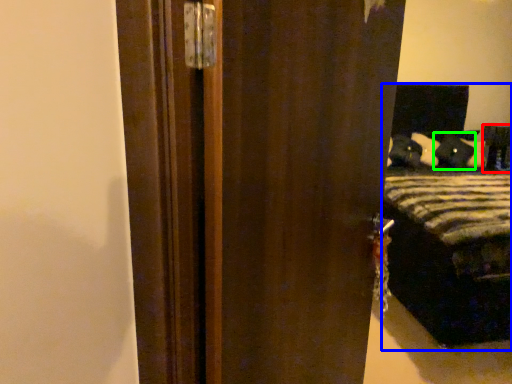
Question: Which object is the closest to the furniture (highlighted by a red box)? Choose among these: bed (highlighted by a blue box) or pillow (highlighted by a green box).

Choices:
 (A) bed
 (B) pillow

Answer: (B)